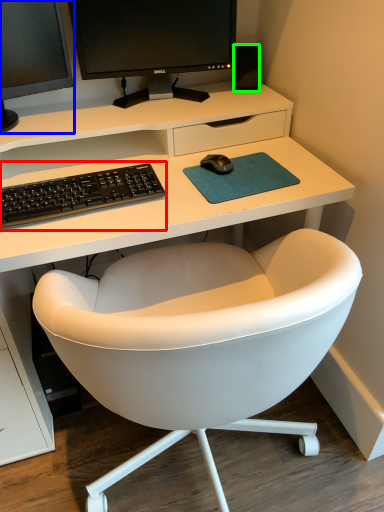
Question: Considering the real-world distances, which object is closest to computer keyboard (highlighted by a red box)? computer monitor (highlighted by a blue box) or speaker (highlighted by a green box).

Choices:
 (A) computer monitor
 (B) speaker

Answer: (A)